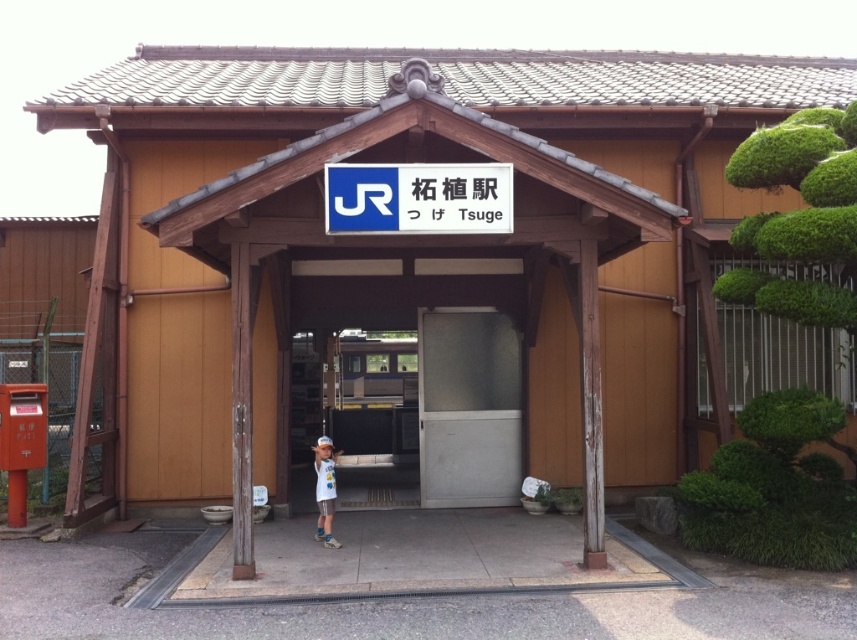
In the scene shown: You are a tourist at the Tsuge station entrance. You see a blue plastic sign at center and a white cotton shirt at center. Which object is more to the right?

The blue plastic sign at center is positioned on the right side of white cotton shirt at center, so the blue plastic sign at center is more to the right.

You are a delivery person with a large box that is 1.2 meters wide. You need to enter the station through the entrance. The entrance has a white matte door at center and a blue plastic sign at center. Can your box fit through the door?

The white matte door at center is narrower than the blue plastic sign at center. Since the door is narrower than the box which is 1.2 meters wide, the box cannot fit through the white matte door at center.

Looking at this image, you are a photographer taking a picture of the entrance of Tsuge station. You notice the blue plastic sign at center and the white cotton shirt at center. Which object is wider in the photo?

The blue plastic sign at center is wider than the white cotton shirt at center.